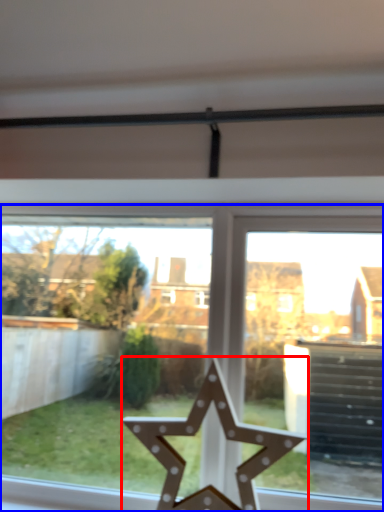
Question: Which of the following is the farthest to the observer, star (highlighted by a red box) or window (highlighted by a blue box)?

Choices:
 (A) star
 (B) window

Answer: (B)